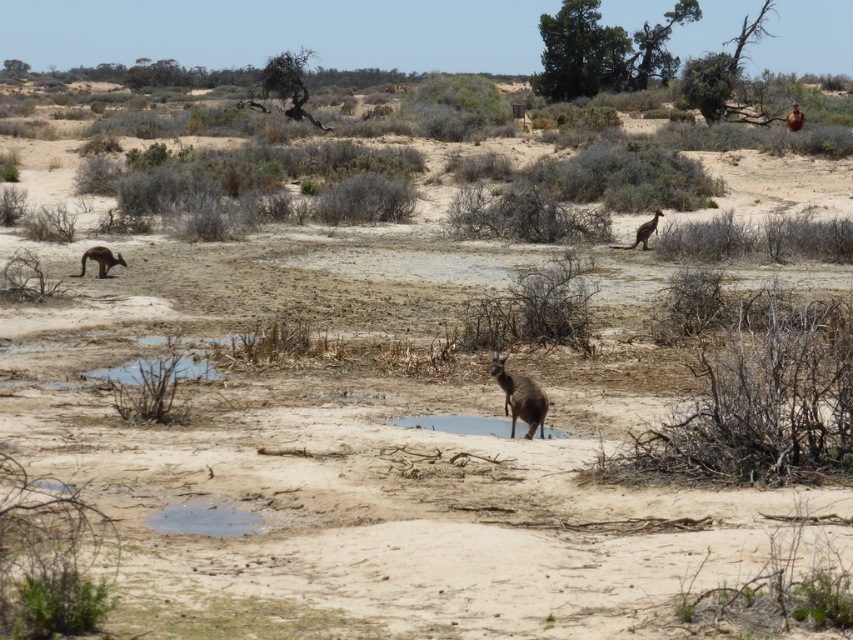
You are a photographer positioned at the camera location. You want to capture a photo that includes both point [439,419] and point [96,246]. Which point will appear larger in the photo?

Point [439,419] will appear larger in the photo because it is closer to the camera than point [96,246]. Objects closer to the camera generally appear larger in photographs.

You are a photographer trying to capture the kangaroos in this semi desert scene. You need to know which kangaroo is smaller in width between the brown fur kangaroo at left and the brown fur kangaroo at upper right. Which one should you focus on for a closeup shot to highlight its smaller size?

The brown fur kangaroo at left has a lesser width compared to the brown fur kangaroo at upper right, so you should focus on the brown fur kangaroo at left for a closeup shot to highlight its smaller size.